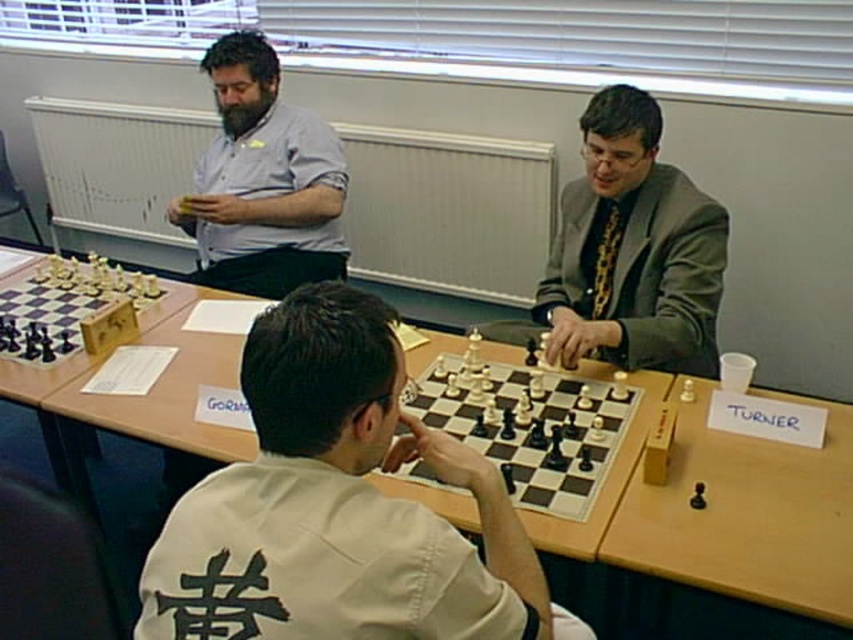
Looking at this image, you are a spectator at the chess tournament and want to take a photo of the white matte chessboard at center and the matte gray shirt at upper left. To ensure both are in frame, should you position your camera to the left or right of the scene?

You should position your camera to the right of the scene because the white matte chessboard at center is to the right of the matte gray shirt at upper left, so placing the camera to the right would capture both objects within the frame.